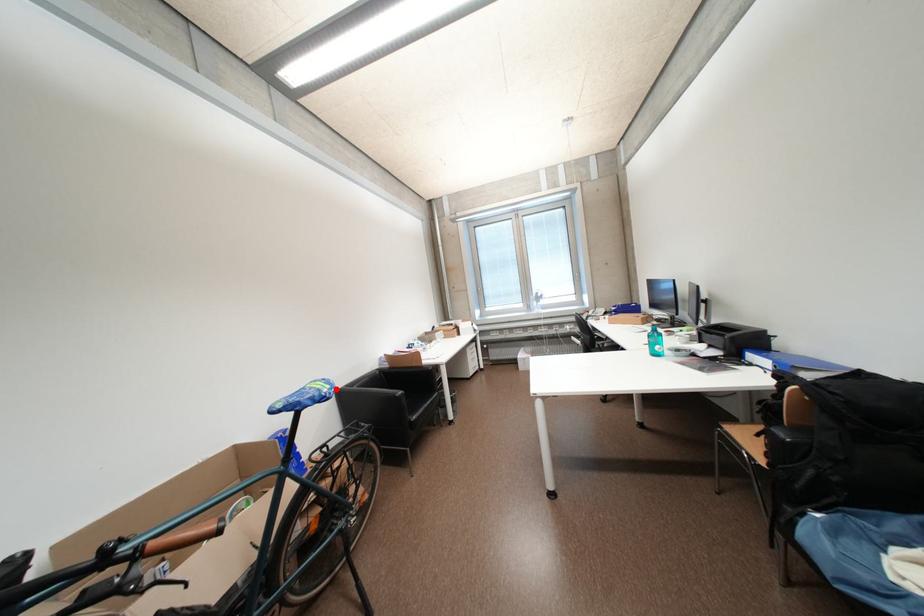
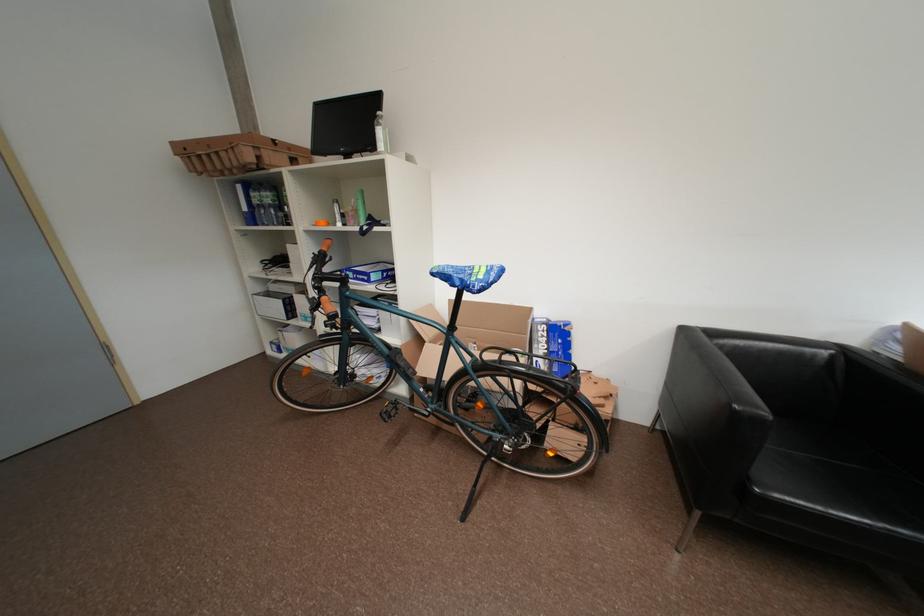
Where in the second image is the point corresponding to the highlighted location from the first image?

(489, 278)